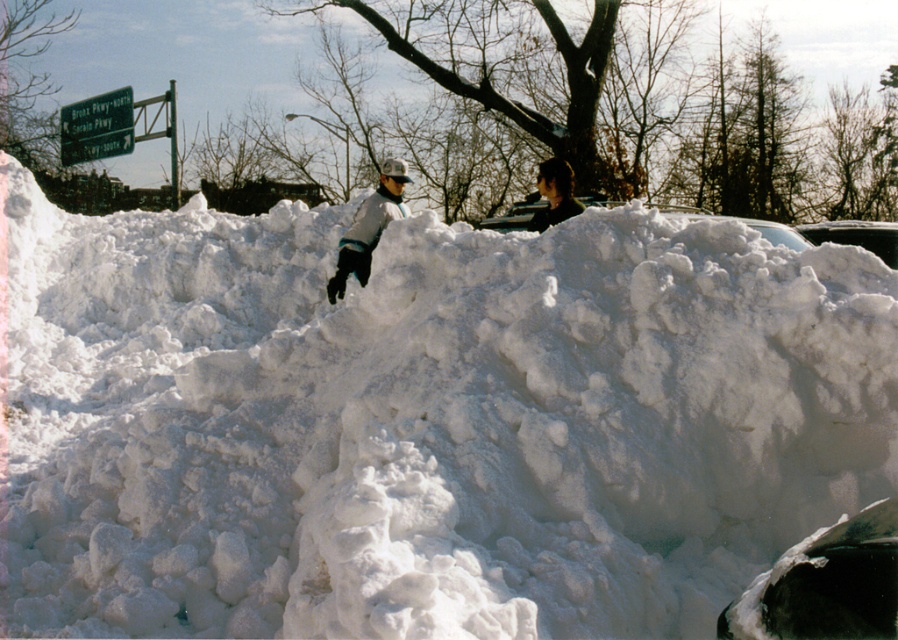
Question: Can you confirm if clear glass car at upper right is positioned to the right of dark brown hair at upper center?

Choices:
 (A) no
 (B) yes

Answer: (B)

Question: Which of the following is the farthest from the observer?

Choices:
 (A) (533, 224)
 (B) (822, 237)
 (C) (359, 280)

Answer: (B)

Question: Estimate the real-world distances between objects in this image. Which object is farther from the dark brown hair at upper center?

Choices:
 (A) gray fleece jacket at center
 (B) clear glass car at upper right

Answer: (B)

Question: Does gray fleece jacket at center appear on the right side of clear glass car at upper right?

Choices:
 (A) no
 (B) yes

Answer: (A)

Question: Does gray fleece jacket at center appear on the left side of clear glass car at upper right?

Choices:
 (A) yes
 (B) no

Answer: (A)

Question: Among these points, which one is nearest to the camera?

Choices:
 (A) (882, 246)
 (B) (549, 220)

Answer: (B)